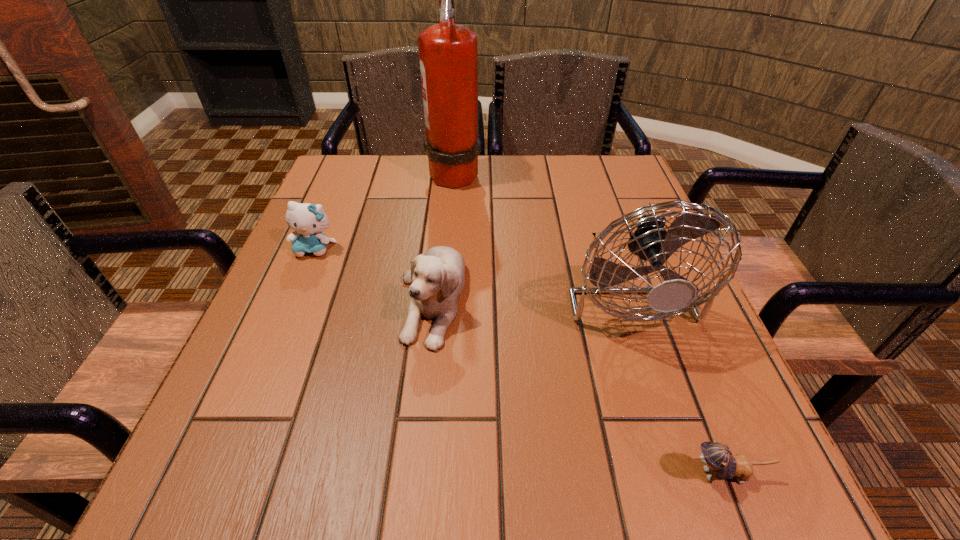
Where is `free spot between the fire extinguisher and the second tallest object`? The width and height of the screenshot is (960, 540). free spot between the fire extinguisher and the second tallest object is located at coordinates (540, 229).

Locate an element on the screen. The width and height of the screenshot is (960, 540). vacant area between the puppy and the farthest object is located at coordinates (444, 235).

At what (x,y) coordinates should I click in order to perform the action: click on unoccupied position between the tallest object and the puppy. Please return your answer as a coordinate pair (x, y). Looking at the image, I should click on (444, 235).

This screenshot has height=540, width=960. In order to click on free spot between the puppy and the farthest object in this screenshot , I will do `click(444, 235)`.

At what (x,y) coordinates should I click in order to perform the action: click on unoccupied position between the puppy and the nearer kitten. Please return your answer as a coordinate pair (x, y). The height and width of the screenshot is (540, 960). Looking at the image, I should click on (579, 386).

Find the location of a particular element. Image resolution: width=960 pixels, height=540 pixels. empty location between the taller kitten and the puppy is located at coordinates (373, 274).

The height and width of the screenshot is (540, 960). In order to click on free area in between the farther kitten and the shorter kitten in this screenshot , I will do `click(520, 362)`.

Locate an element on the screen. This screenshot has height=540, width=960. free spot between the puppy and the farther kitten is located at coordinates (373, 274).

Locate an element on the screen. This screenshot has width=960, height=540. object that is the third closest to the shorter kitten is located at coordinates (308, 221).

Select which object is the closest to the shortest object. Please provide its 2D coordinates. Your answer should be formatted as a tuple, i.e. [(x, y)], where the tuple contains the x and y coordinates of a point satisfying the conditions above.

[(650, 241)]